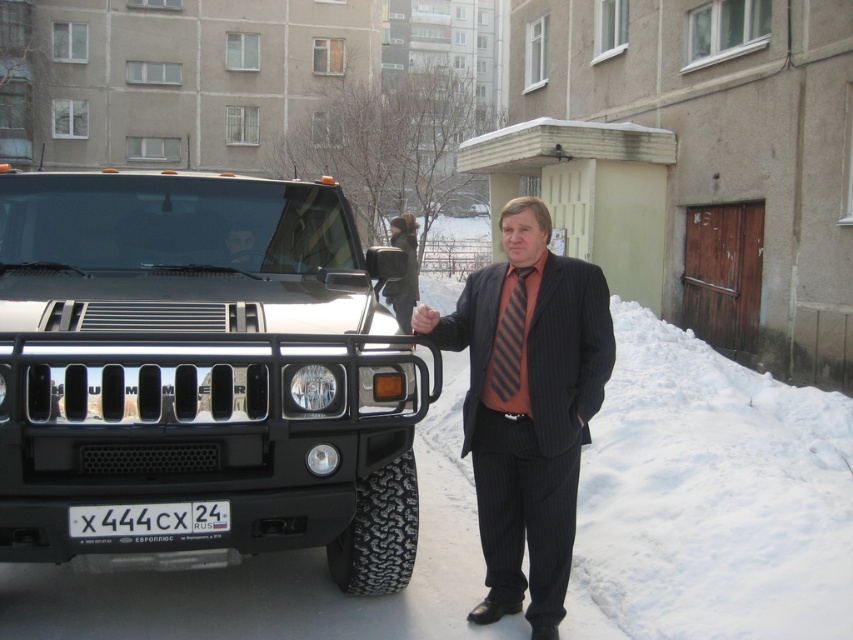
You are a delivery person who needs to deliver a package to the address on the white plastic license plate at center. The delivery requires you to stand exactly at the coordinates provided. Can you confirm if the license plate is positioned at the center of the vehicle?

The white plastic license plate at center is located at the coordinates point [149,518], so yes, it is positioned at the center of the vehicle.

You are a police officer examining the scene. You notice the white plastic license plate at center and the striped fabric tie at center. Which object is located to the left of the other?

The white plastic license plate at center is positioned on the left side of striped fabric tie at center.

Based on the photo, you are a photographer trying to capture the man in the snow scene. You notice the striped fabric tie at center and the matte black hand at center. Which object is closer to the camera lens?

The striped fabric tie at center is in front of the matte black hand at center, so the striped fabric tie at center is closer to the camera lens.